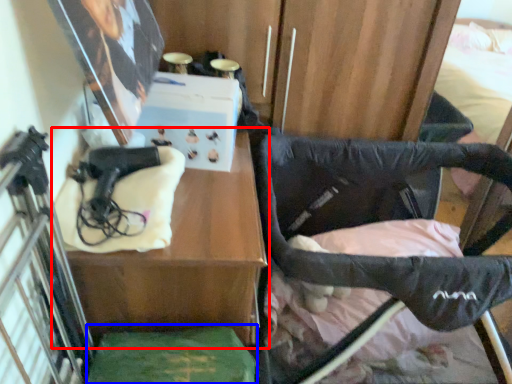
Question: Among these objects, which one is farthest to the camera, table (highlighted by a red box) or wide (highlighted by a blue box)?

Choices:
 (A) table
 (B) wide

Answer: (A)